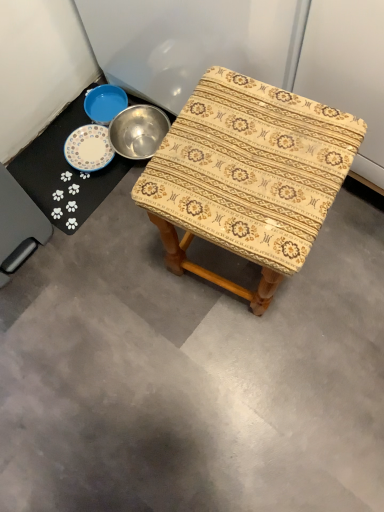
Locate an element on the screen. vacant space in front of patterned fabric stool at center is located at coordinates (266, 358).